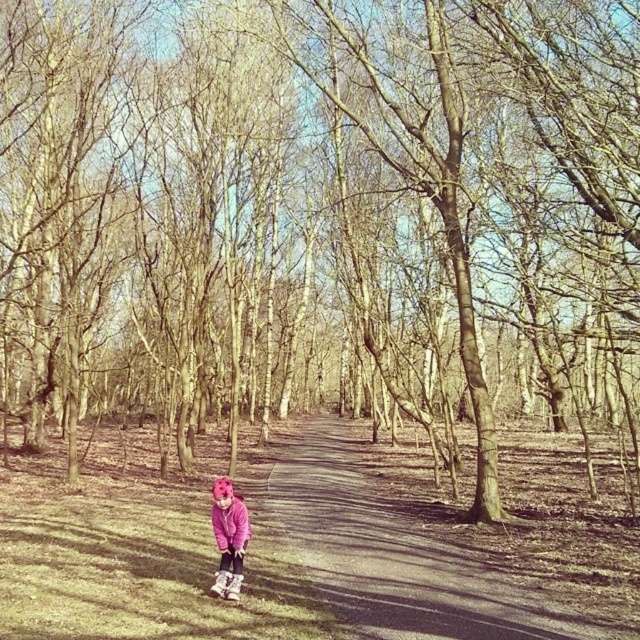
Question: Which point is farther to the camera?

Choices:
 (A) (228, 518)
 (B) (385, 545)

Answer: (B)

Question: Where is brown dirt path at center located in relation to pink fleece sweatshirt at center in the image?

Choices:
 (A) below
 (B) above

Answer: (A)

Question: Which object appears farthest from the camera in this image?

Choices:
 (A) pink fleece sweatshirt at center
 (B) brown dirt path at center

Answer: (A)

Question: Considering the relative positions of brown dirt path at center and pink fleece sweatshirt at center in the image provided, where is brown dirt path at center located with respect to pink fleece sweatshirt at center?

Choices:
 (A) below
 (B) above

Answer: (A)

Question: Does brown dirt path at center appear over pink fleece sweatshirt at center?

Choices:
 (A) yes
 (B) no

Answer: (B)